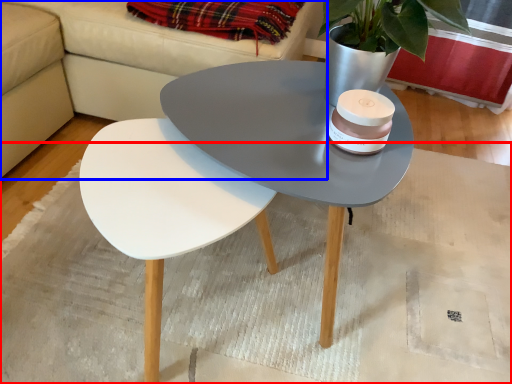
Question: Which object appears farthest to the camera in this image, mat (highlighted by a red box) or couch (highlighted by a blue box)?

Choices:
 (A) mat
 (B) couch

Answer: (B)